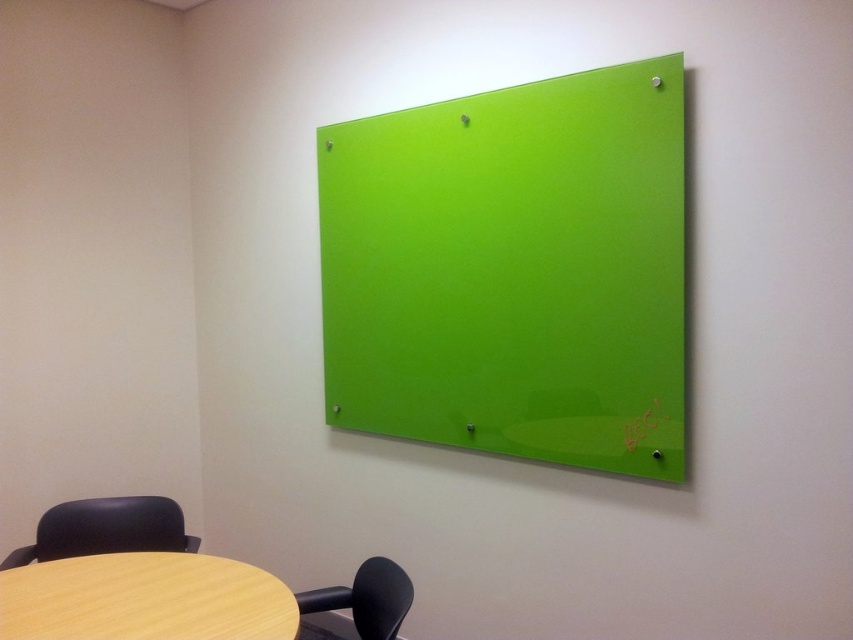
Is wooden table at lower left behind black leather swivel chair at lower left?

No, wooden table at lower left is closer to the viewer.

Consider the image. Between wooden table at lower left and black leather swivel chair at lower left, which one is positioned lower?

Positioned lower is black leather swivel chair at lower left.

Who is more distant from viewer, (102, 557) or (146, 509)?

Point (146, 509)

Identify the location of wooden table at lower left. The height and width of the screenshot is (640, 853). (144, 598).

Can you confirm if black leather swivel chair at lower left is positioned above matte black chair at lower left?

Incorrect, black leather swivel chair at lower left is not positioned above matte black chair at lower left.

Between point (12, 560) and point (332, 604), which one is positioned behind?

Point (12, 560)

Does point (138, 541) come closer to viewer compared to point (312, 593)?

No, (138, 541) is further to viewer.

Identify the location of black leather swivel chair at lower left. (105, 529).

Can you confirm if wooden table at lower left is shorter than matte black chair at lower left?

Yes, wooden table at lower left is shorter than matte black chair at lower left.

Is point (113, 628) less distant than point (387, 564)?

Yes, point (113, 628) is closer to viewer.

The width and height of the screenshot is (853, 640). In order to click on wooden table at lower left in this screenshot , I will do `click(144, 598)`.